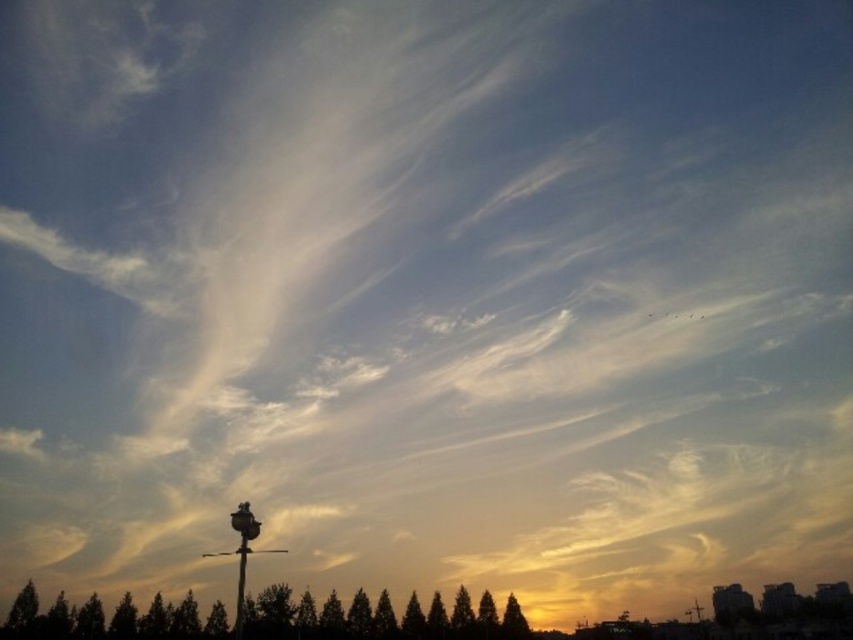
Does satin black lamp post at lower center appear on the right side of metallic pole at center?

No, satin black lamp post at lower center is not to the right of metallic pole at center.

Does point (285, 552) come in front of point (239, 548)?

No, it is behind (239, 548).

Who is more forward, [231,552] or [244,564]?

Point [244,564] is in front.

The image size is (853, 640). Identify the location of satin black lamp post at lower center. (242, 556).

Based on the photo, can you confirm if green matte trees at lower center is positioned below metallic pole at center?

Correct, green matte trees at lower center is located below metallic pole at center.

Is point (454, 630) farther from camera compared to point (236, 628)?

Yes.

Is point (366, 595) behind point (245, 552)?

Yes.

Image resolution: width=853 pixels, height=640 pixels. In order to click on green matte trees at lower center in this screenshot , I will do `click(367, 618)`.

Is satin black lamp post at lower center to the right of green matte tree at lower center from the viewer's perspective?

In fact, satin black lamp post at lower center is to the left of green matte tree at lower center.

Between point (234, 525) and point (519, 637), which one is positioned behind?

The point (519, 637) is behind.

Image resolution: width=853 pixels, height=640 pixels. I want to click on satin black lamp post at lower center, so click(x=242, y=556).